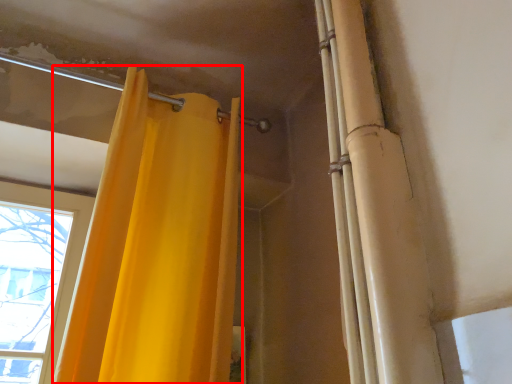
Question: From the image's perspective, what is the correct spatial positioning of curtain (annotated by the red box) in reference to shower curtain?

Choices:
 (A) below
 (B) above

Answer: (A)